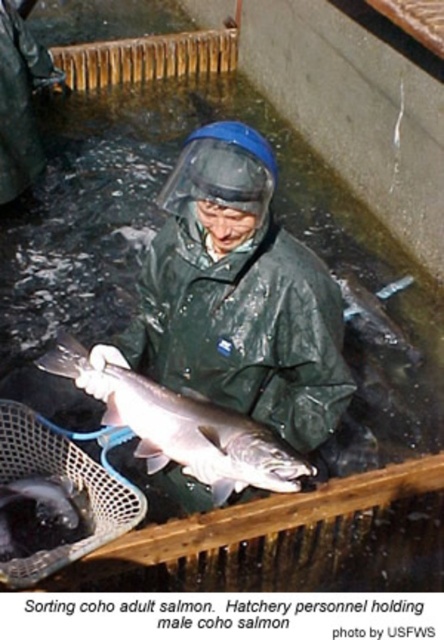
Does shiny silver fish at center have a greater width compared to shiny black fish at lower left?

Yes.

I want to click on shiny silver fish at center, so click(182, 428).

Does point (163, 429) come farther from viewer compared to point (58, 492)?

No, it is not.

Find the location of a particular element. The width and height of the screenshot is (444, 640). shiny silver fish at center is located at coordinates (182, 428).

Who is taller, green matte jacket at center or shiny silver fish at center?

With more height is green matte jacket at center.

Is point (141, 300) positioned in front of point (245, 464)?

No.

Who is more forward, (x=194, y=237) or (x=226, y=444)?

Point (x=226, y=444)

At what (x,y) coordinates should I click in order to perform the action: click on green matte jacket at center. Please return your answer as a coordinate pair (x, y). This screenshot has width=444, height=640. Looking at the image, I should click on (237, 296).

Who is more forward, (226,154) or (47,545)?

Point (226,154) is in front.

Is green matte jacket at center bigger than shiny black fish at lower left?

Yes, green matte jacket at center is bigger than shiny black fish at lower left.

Does point (201, 168) come in front of point (47, 547)?

Yes, it is.

What are the coordinates of `green matte jacket at center` in the screenshot? It's located at (237, 296).